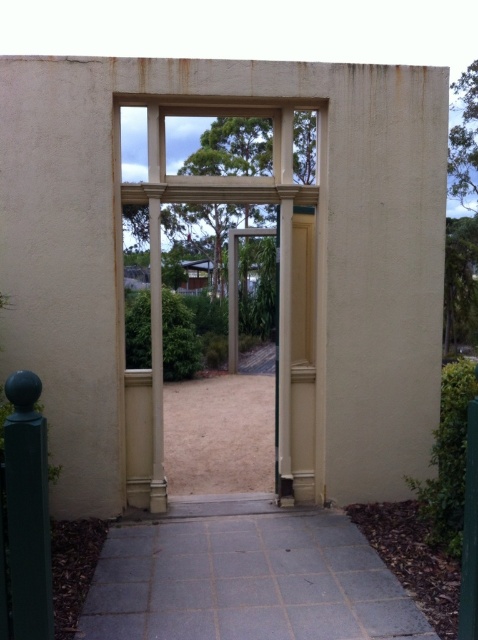
Does gray concrete path at center appear under matte cream column at center?

Correct, gray concrete path at center is located below matte cream column at center.

What do you see at coordinates (246, 579) in the screenshot? I see `gray concrete path at center` at bounding box center [246, 579].

What do you see at coordinates (246, 579) in the screenshot? I see `gray concrete path at center` at bounding box center [246, 579].

Image resolution: width=478 pixels, height=640 pixels. In order to click on gray concrete path at center in this screenshot , I will do `click(246, 579)`.

Between point (153, 371) and point (9, 387), which one is positioned behind?

The point (153, 371) is more distant.

Is beige stone door at center wider than dark green polished post at left?

Correct, the width of beige stone door at center exceeds that of dark green polished post at left.

Is point (237, 106) positioned after point (14, 572)?

Yes.

The width and height of the screenshot is (478, 640). What are the coordinates of `beige stone door at center` in the screenshot? It's located at (280, 289).

Is point (242, 545) closer to camera compared to point (28, 602)?

No, it is not.

Who is more distant from viewer, (x=120, y=604) or (x=15, y=468)?

Positioned behind is point (x=120, y=604).

Who is more distant from viewer, [171,595] or [33,634]?

The point [171,595] is behind.

Locate an element on the screen. This screenshot has height=640, width=478. gray concrete path at center is located at coordinates tap(246, 579).